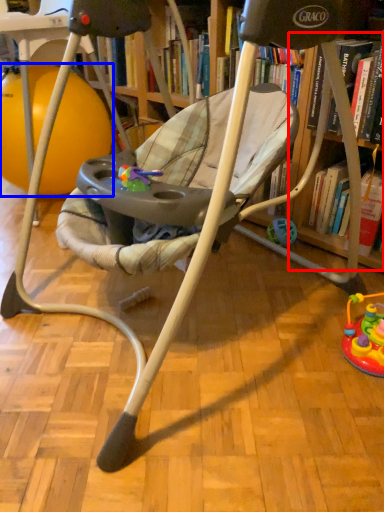
Question: Which point is closer to the camera, shelf (highlighted by a red box) or ball (highlighted by a blue box)?

Choices:
 (A) shelf
 (B) ball

Answer: (A)